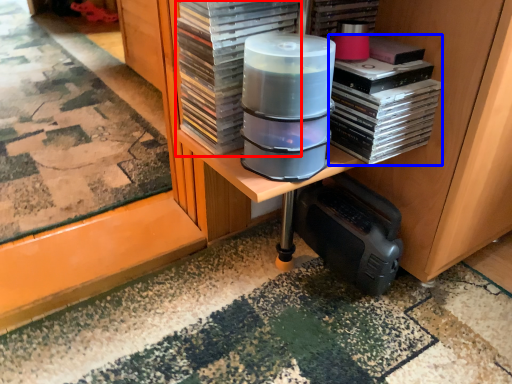
Question: Which point is closer to the camera, paperback book (highlighted by a red box) or book (highlighted by a blue box)?

Choices:
 (A) paperback book
 (B) book

Answer: (A)